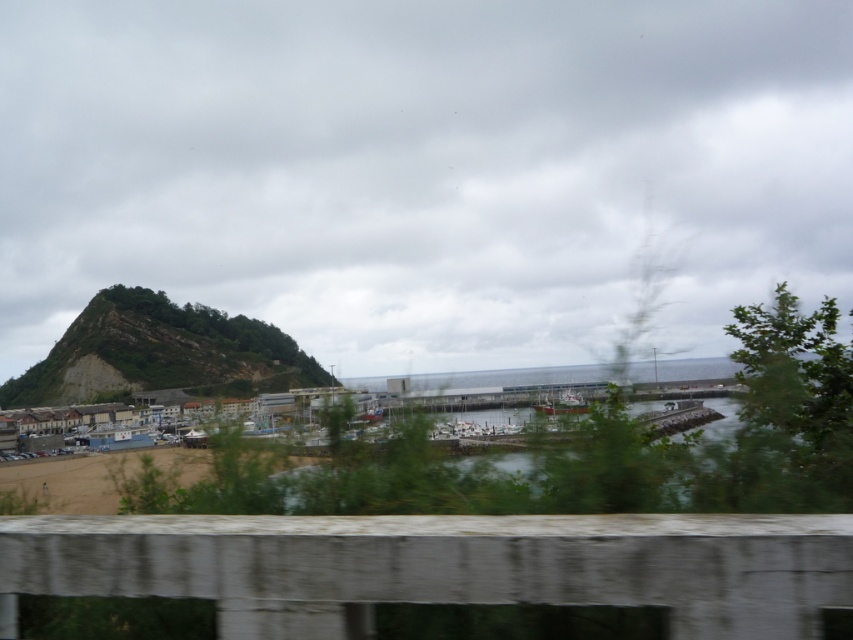
You are a passenger on a train passing through this coastal area. You look out the transparent glass train window at center and see the green rocky hill at left. Can you tell me which object is bigger in your view?

The green rocky hill at left is larger in size than the transparent glass train window at center, so the green rocky hill at left appears bigger in your view.

You are a hiker who wants to take a photo of the green rocky hill at left and the brown sand at lower left. Which object should you focus on if you want the one that takes up more space in the photo?

The green rocky hill at left is larger in size than the brown sand at lower left, so you should focus on the green rocky hill at left to capture more of it in your photo.